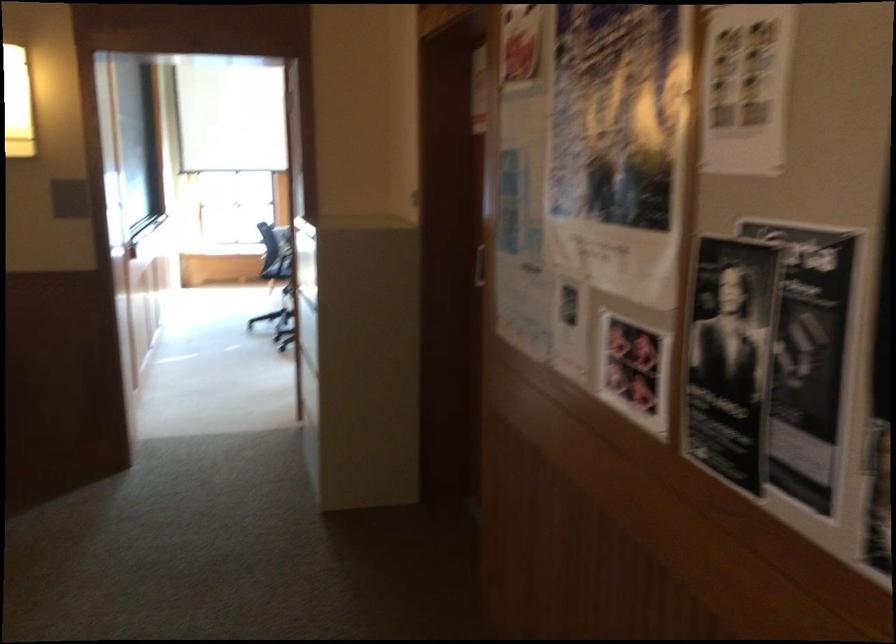
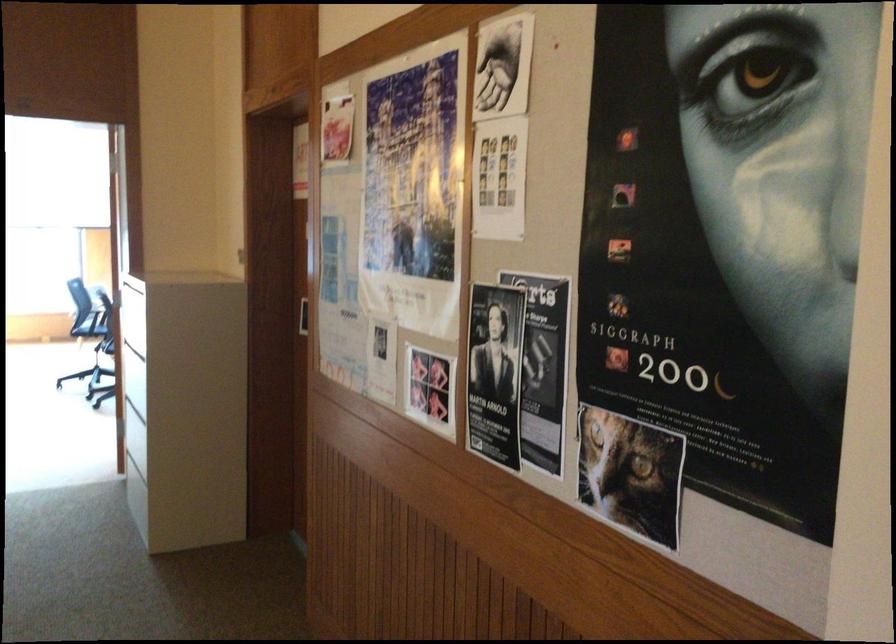
In the second image, find the point that corresponds to [476,261] in the first image.

(300, 315)